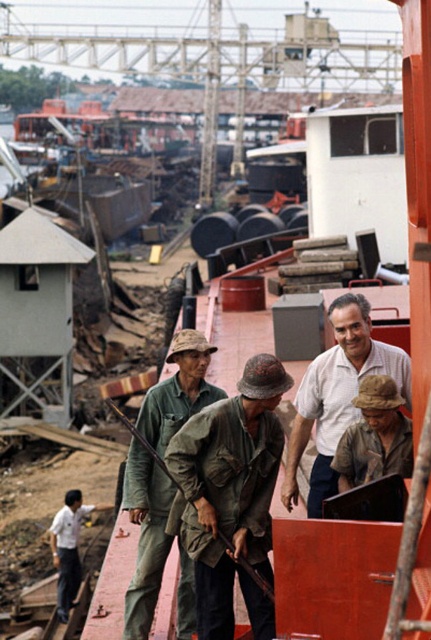
Is white cotton shirt at center closer to camera compared to green camouflage uniform at lower left?

Yes, white cotton shirt at center is closer to the viewer.

Does white cotton shirt at center appear on the left side of green camouflage uniform at lower left?

Incorrect, white cotton shirt at center is not on the left side of green camouflage uniform at lower left.

Identify the location of white cotton shirt at center. (337, 396).

Where is `white cotton shirt at center`? The width and height of the screenshot is (431, 640). white cotton shirt at center is located at coordinates (337, 396).

Between camouflage fabric hat at center and brown fabric hat at center, which one appears on the left side from the viewer's perspective?

camouflage fabric hat at center

In the scene shown: Does camouflage fabric hat at center have a lesser width compared to brown fabric hat at center?

In fact, camouflage fabric hat at center might be wider than brown fabric hat at center.

Is point (139, 595) positioned in front of point (384, 385)?

No, it is not.

Find the location of `camouflage fabric hat at center`. camouflage fabric hat at center is located at coordinates (146, 536).

The width and height of the screenshot is (431, 640). What do you see at coordinates (337, 396) in the screenshot? I see `white cotton shirt at center` at bounding box center [337, 396].

Is point (369, 344) behind point (380, 394)?

Yes, point (369, 344) is farther from viewer.

Find the location of a particular element. white cotton shirt at center is located at coordinates (337, 396).